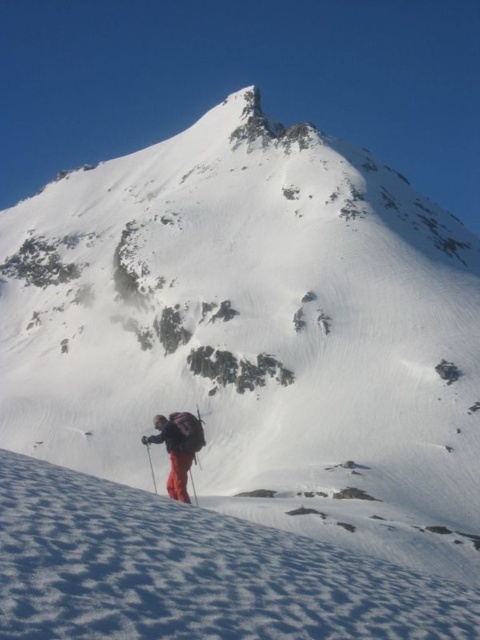
Measure the distance from red fabric backpack at lower center to matte black ski pole at lower center.

12.46 feet

Who is more forward, (169,490) or (190,477)?

Point (169,490)

Locate an element on the screen. red fabric backpack at lower center is located at coordinates click(178, 448).

From the picture: Can you confirm if black plastic ski pole at lower center is wider than matte black ski pole at lower center?

Yes.

Is point (152, 474) farther from camera compared to point (191, 483)?

Yes.

Which is in front, point (153, 484) or point (196, 497)?

Point (196, 497)

In order to click on black plastic ski pole at lower center in this screenshot , I will do [149, 461].

Between white powdery snow at lower center and red fabric backpack at lower center, which one is positioned lower?

red fabric backpack at lower center

Does white powdery snow at lower center have a larger size compared to red fabric backpack at lower center?

Correct, white powdery snow at lower center is larger in size than red fabric backpack at lower center.

Image resolution: width=480 pixels, height=640 pixels. Identify the location of white powdery snow at lower center. (192, 572).